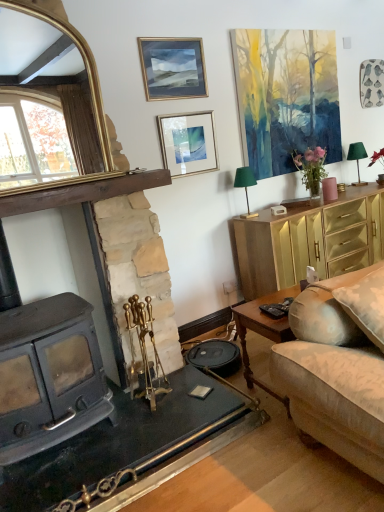
Identify the location of vacant region above watercolor painting at upper right, the third picture frame positioned from the left (from a real-world perspective). The image size is (384, 512). (285, 30).